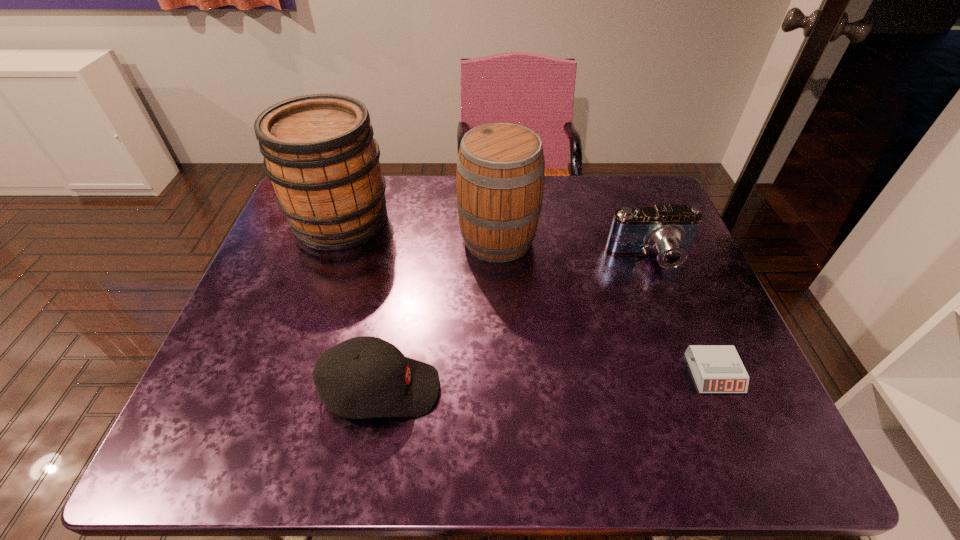
At what (x,y) coordinates should I click in order to perform the action: click on the left cider. Please return your answer as a coordinate pair (x, y). This screenshot has height=540, width=960. Looking at the image, I should click on (319, 152).

I want to click on the third object from left to right, so click(500, 174).

Find the location of `camcorder`. camcorder is located at coordinates (668, 231).

Find the location of `baseball cap`. baseball cap is located at coordinates (363, 377).

Where is `alarm clock`? Image resolution: width=960 pixels, height=540 pixels. alarm clock is located at coordinates (716, 368).

Locate an element on the screen. The width and height of the screenshot is (960, 540). free spot located on the front of the left cider is located at coordinates (298, 343).

You are a GUI agent. You are given a task and a screenshot of the screen. Output one action in this format:
    pyautogui.click(x=<x>, y=<y>)
    Task: Click on the vacant position located on the right of the right cider
    The image size is (960, 540).
    Given the screenshot: What is the action you would take?
    pyautogui.click(x=566, y=239)

Find the location of a particular element. This screenshot has height=540, width=960. free region located on the front-facing side of the camcorder is located at coordinates (666, 300).

Image resolution: width=960 pixels, height=540 pixels. Identify the location of free spot located with a logo on the front of the baseball cap. (597, 389).

Locate an element on the screen. The width and height of the screenshot is (960, 540). free region located on the back of the alarm clock is located at coordinates (676, 284).